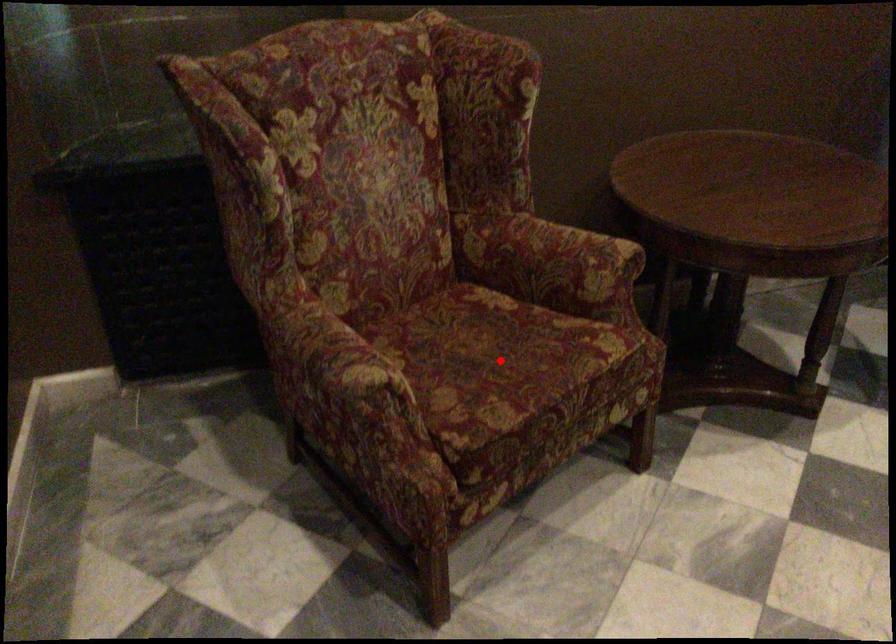
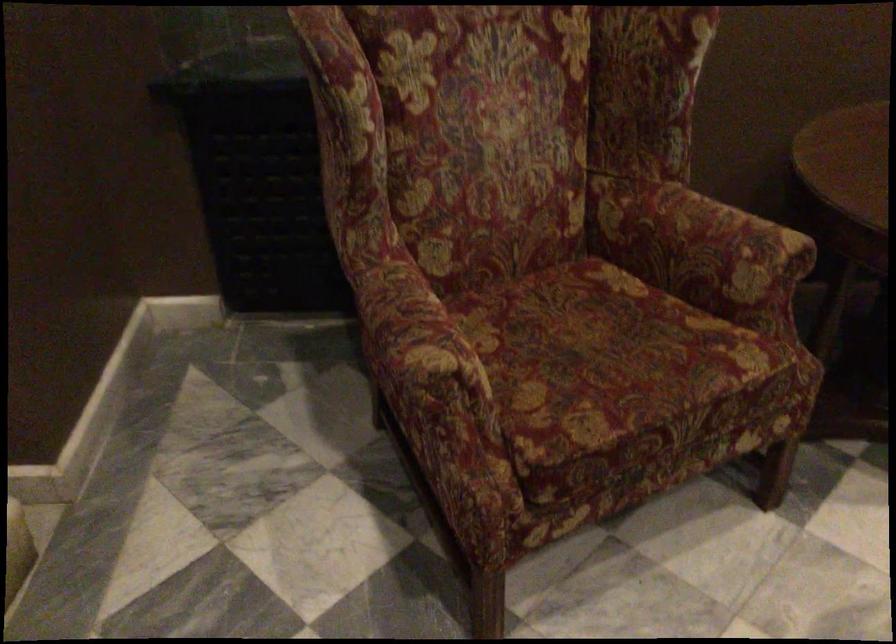
Question: A red point is marked in image1. In image2, is the corresponding 3D point closer to the camera or farther? Reply with the corresponding letter.

Choices:
 (A) The corresponding 3D point is closer.
 (B) The corresponding 3D point is farther.

Answer: (A)